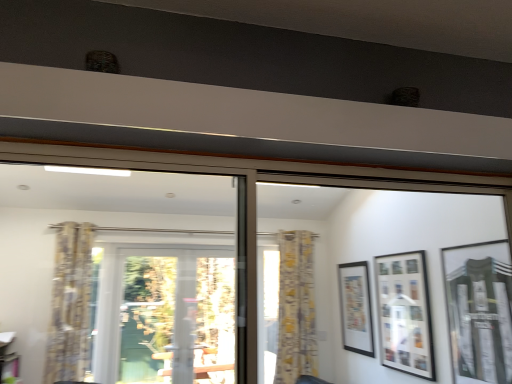
Question: Is matte black picture frame at center right, the 1th picture frame when ordered from back to front, further to camera compared to matte glass picture frame at right, which is the first picture frame from front to back?

Choices:
 (A) yes
 (B) no

Answer: (A)

Question: From a real-world perspective, is matte black picture frame at center right, the 3th picture frame in the right-to-left sequence, positioned over matte glass picture frame at right, which is the first picture frame from front to back, based on gravity?

Choices:
 (A) no
 (B) yes

Answer: (A)

Question: Would you say matte black picture frame at center right, the 3th picture frame in the right-to-left sequence, is a long distance from matte glass picture frame at right, which ranks as the 3th picture frame in left-to-right order?

Choices:
 (A) yes
 (B) no

Answer: (A)

Question: Is the depth of matte black picture frame at center right, marked as the third picture frame in a front-to-back arrangement, less than that of matte glass picture frame at right, which is the first picture frame from front to back?

Choices:
 (A) yes
 (B) no

Answer: (B)

Question: From a real-world perspective, is matte black picture frame at center right, the 1th picture frame when ordered from back to front, under matte glass picture frame at right, which is the first picture frame from front to back?

Choices:
 (A) yes
 (B) no

Answer: (A)

Question: Considering the positions of matte black picture frame at center right, the 1th picture frame when ordered from back to front, and yellow floral fabric curtain at center, the second curtain viewed from the front, in the image, is matte black picture frame at center right, the 1th picture frame when ordered from back to front, taller or shorter than yellow floral fabric curtain at center, the second curtain viewed from the front,?

Choices:
 (A) short
 (B) tall

Answer: (A)

Question: Is matte black picture frame at center right, which ranks as the first picture frame in left-to-right order, inside or outside of yellow floral fabric curtain at center, placed as the 2th curtain when sorted from left to right?

Choices:
 (A) outside
 (B) inside

Answer: (A)

Question: Is matte black picture frame at center right, the 1th picture frame when ordered from back to front, wider or thinner than yellow floral fabric curtain at center, placed as the 2th curtain when sorted from left to right?

Choices:
 (A) wide
 (B) thin

Answer: (B)

Question: From a real-world perspective, is matte black picture frame at center right, the 1th picture frame when ordered from back to front, above or below yellow floral fabric curtain at center, placed as the 2th curtain when sorted from left to right?

Choices:
 (A) below
 (B) above

Answer: (A)

Question: Does point (307, 248) appear closer or farther from the camera than point (357, 312)?

Choices:
 (A) closer
 (B) farther

Answer: (B)

Question: Based on their sizes in the image, would you say yellow floral fabric curtain at center, placed as the first curtain when sorted from right to left, is bigger or smaller than matte black picture frame at center right, marked as the third picture frame in a front-to-back arrangement?

Choices:
 (A) big
 (B) small

Answer: (A)

Question: Do you think yellow floral fabric curtain at center, placed as the first curtain when sorted from right to left, is within matte black picture frame at center right, the 3th picture frame in the right-to-left sequence, or outside of it?

Choices:
 (A) inside
 (B) outside

Answer: (B)

Question: Visually, is yellow floral fabric curtain at center, the second curtain viewed from the front, positioned to the left or to the right of matte black picture frame at center right, the 3th picture frame in the right-to-left sequence?

Choices:
 (A) left
 (B) right

Answer: (A)

Question: From the image's perspective, relative to yellow floral fabric curtain at center, placed as the 1th curtain when sorted from back to front, is matte glass picture frame at right, which ranks as the 3th picture frame in left-to-right order, above or below?

Choices:
 (A) below
 (B) above

Answer: (B)

Question: In the image, is matte glass picture frame at right, which is the first picture frame from front to back, positioned in front of or behind yellow floral fabric curtain at center, placed as the 2th curtain when sorted from left to right?

Choices:
 (A) front
 (B) behind

Answer: (A)